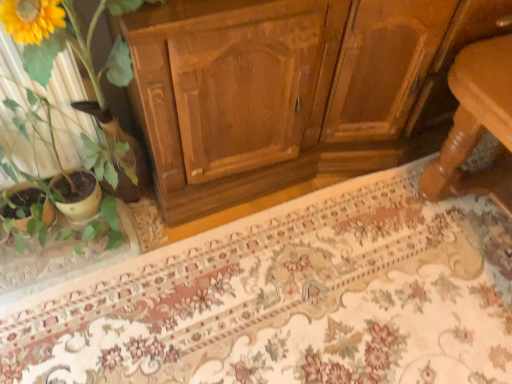
Where is `matte yellow pot at left`? matte yellow pot at left is located at coordinates (67, 39).

Image resolution: width=512 pixels, height=384 pixels. What do you see at coordinates (67, 39) in the screenshot?
I see `matte yellow pot at left` at bounding box center [67, 39].

Describe the element at coordinates (290, 299) in the screenshot. I see `floral carpet at center` at that location.

Locate an element on the screen. Image resolution: width=512 pixels, height=384 pixels. floral carpet at center is located at coordinates (290, 299).

Where is `matte yellow pot at left`? This screenshot has height=384, width=512. matte yellow pot at left is located at coordinates (67, 39).

Considering the positions of objects floral carpet at center and matte yellow pot at left in the image provided, who is more to the left, floral carpet at center or matte yellow pot at left?

From the viewer's perspective, matte yellow pot at left appears more on the left side.

Does floral carpet at center lie behind matte yellow pot at left?

Yes, floral carpet at center is further from the camera.

Considering the positions of points (59, 305) and (37, 73), is point (59, 305) farther from camera compared to point (37, 73)?

Yes, point (59, 305) is farther from viewer.

From the picture: From the image's perspective, is floral carpet at center positioned above or below matte yellow pot at left?

Based on their image positions, floral carpet at center is located beneath matte yellow pot at left.

In the scene shown: From a real-world perspective, is floral carpet at center located beneath matte yellow pot at left?

Yes, from a real-world perspective, floral carpet at center is under matte yellow pot at left.

Does floral carpet at center have a lesser width compared to matte yellow pot at left?

No, floral carpet at center is not thinner than matte yellow pot at left.

Considering the sizes of floral carpet at center and matte yellow pot at left in the image, is floral carpet at center taller or shorter than matte yellow pot at left?

Clearly, floral carpet at center is shorter compared to matte yellow pot at left.

Who is smaller, floral carpet at center or matte yellow pot at left?

floral carpet at center.

Is floral carpet at center situated inside matte yellow pot at left or outside?

floral carpet at center is located beyond the bounds of matte yellow pot at left.

Are floral carpet at center and matte yellow pot at left far apart?

No, floral carpet at center is not far away from matte yellow pot at left.

Is floral carpet at center positioned with its back to matte yellow pot at left?

No, floral carpet at center's orientation is not away from matte yellow pot at left.

How different are the orientations of floral carpet at center and matte yellow pot at left in degrees?

0.669 degrees separate the facing orientations of floral carpet at center and matte yellow pot at left.

This screenshot has width=512, height=384. In order to click on houseplant to the left of floral carpet at center in this screenshot , I will do `click(67, 39)`.

Which is more to the right, matte yellow pot at left or floral carpet at center?

Positioned to the right is floral carpet at center.

Who is more distant, matte yellow pot at left or floral carpet at center?

floral carpet at center is further from the camera.

Is point (40, 77) less distant than point (400, 257)?

Yes, point (40, 77) is in front of point (400, 257).

From the image's perspective, would you say matte yellow pot at left is shown under floral carpet at center?

No, from the image's perspective, matte yellow pot at left is not beneath floral carpet at center.

From a real-world perspective, is matte yellow pot at left below floral carpet at center?

No, from a real-world perspective, matte yellow pot at left is not beneath floral carpet at center.

Considering the sizes of objects matte yellow pot at left and floral carpet at center in the image provided, who is thinner, matte yellow pot at left or floral carpet at center?

matte yellow pot at left is thinner.

Between matte yellow pot at left and floral carpet at center, which one has less height?

floral carpet at center.

Can you confirm if matte yellow pot at left is smaller than floral carpet at center?

Incorrect, matte yellow pot at left is not smaller in size than floral carpet at center.

Is matte yellow pot at left not within floral carpet at center?

Yes.

Can you see matte yellow pot at left touching floral carpet at center?

No, matte yellow pot at left is not beside floral carpet at center.

Is matte yellow pot at left facing towards floral carpet at center?

No, matte yellow pot at left is not aimed at floral carpet at center.

Where is `doormat below the matte yellow pot at left (from the image's perspective)`? The image size is (512, 384). doormat below the matte yellow pot at left (from the image's perspective) is located at coordinates (290, 299).

I want to click on houseplant above the floral carpet at center (from a real-world perspective), so click(x=67, y=39).

I want to click on doormat on the right side of matte yellow pot at left, so click(x=290, y=299).